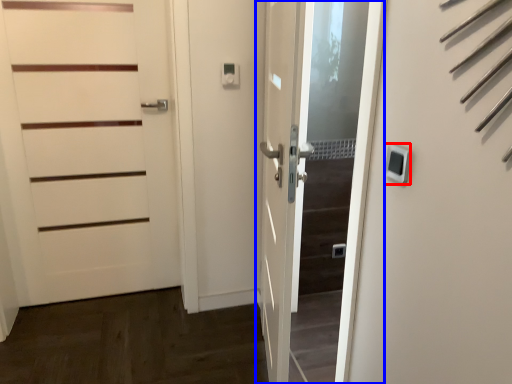
Question: Among these objects, which one is farthest to the camera, thermostat (highlighted by a red box) or door (highlighted by a blue box)?

Choices:
 (A) thermostat
 (B) door

Answer: (B)